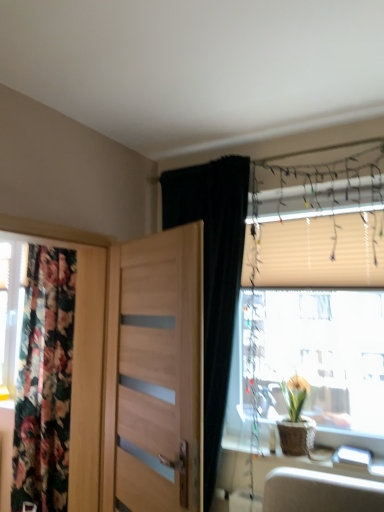
Question: Is black velvet curtain at upper center, the first curtain in the front-to-back sequence, positioned far away from light wood door at center?

Choices:
 (A) no
 (B) yes

Answer: (A)

Question: Is black velvet curtain at upper center, the 1th curtain from the right, looking in the opposite direction of light wood door at center?

Choices:
 (A) no
 (B) yes

Answer: (B)

Question: Is black velvet curtain at upper center, which is counted as the second curtain, starting from the left, at the right side of light wood door at center?

Choices:
 (A) no
 (B) yes

Answer: (B)

Question: Could you tell me if black velvet curtain at upper center, which is the second curtain in back-to-front order, is facing light wood door at center?

Choices:
 (A) no
 (B) yes

Answer: (B)

Question: Can you confirm if black velvet curtain at upper center, the first curtain in the front-to-back sequence, is positioned to the left of light wood door at center?

Choices:
 (A) yes
 (B) no

Answer: (B)

Question: From a real-world perspective, relative to beige fabric blind at upper right, is translucent plastic window at right vertically above or below?

Choices:
 (A) above
 (B) below

Answer: (B)

Question: From the image's perspective, is translucent plastic window at right located above or below beige fabric blind at upper right?

Choices:
 (A) below
 (B) above

Answer: (A)

Question: Does point (362, 241) appear closer or farther from the camera than point (311, 266)?

Choices:
 (A) closer
 (B) farther

Answer: (A)

Question: In the image, is translucent plastic window at right positioned in front of or behind beige fabric blind at upper right?

Choices:
 (A) behind
 (B) front

Answer: (B)

Question: From a real-world perspective, is black velvet curtain at upper center, the first curtain in the front-to-back sequence, physically located above or below floral fabric curtain at left, which ranks as the 1th curtain in back-to-front order?

Choices:
 (A) above
 (B) below

Answer: (A)

Question: In terms of width, does black velvet curtain at upper center, the first curtain in the front-to-back sequence, look wider or thinner when compared to floral fabric curtain at left, which ranks as the 1th curtain in back-to-front order?

Choices:
 (A) thin
 (B) wide

Answer: (B)

Question: In the image, is black velvet curtain at upper center, which is the second curtain in back-to-front order, on the left side or the right side of floral fabric curtain at left, which ranks as the 1th curtain in left-to-right order?

Choices:
 (A) right
 (B) left

Answer: (A)

Question: Does point (203, 502) appear closer or farther from the camera than point (56, 351)?

Choices:
 (A) closer
 (B) farther

Answer: (A)

Question: Looking at their shapes, would you say beige fabric blind at upper right is wider or thinner than wooden table at right?

Choices:
 (A) thin
 (B) wide

Answer: (A)

Question: From a real-world perspective, is beige fabric blind at upper right above or below wooden table at right?

Choices:
 (A) above
 (B) below

Answer: (A)